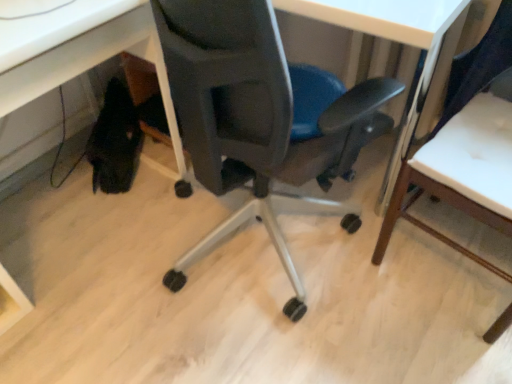
Question: In the image, is matte black chair at center, which is the first chair from left to right, positioned in front of or behind wooden chair at right, the first chair viewed from the right?

Choices:
 (A) behind
 (B) front

Answer: (A)

Question: Based on their sizes in the image, would you say matte black chair at center, which is the first chair from left to right, is bigger or smaller than wooden chair at right, the 2th chair in the left-to-right sequence?

Choices:
 (A) big
 (B) small

Answer: (A)

Question: Which is farther from the wooden chair at right, the 2th chair in the left-to-right sequence?

Choices:
 (A) matte black chair at center, which is the first chair from left to right
 (B) matte black chair at lower left

Answer: (B)

Question: Estimate the real-world distances between objects in this image. Which object is closer to the wooden chair at right, the first chair viewed from the right?

Choices:
 (A) matte black chair at lower left
 (B) matte black chair at center, which is the first chair from left to right

Answer: (B)